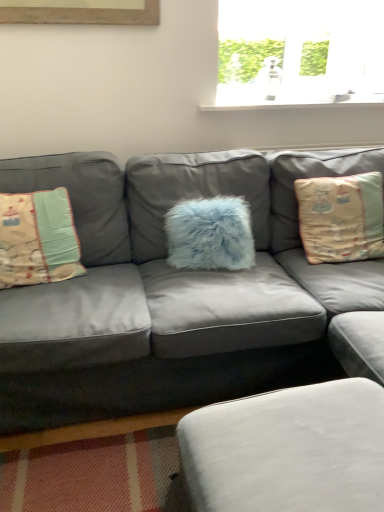
Question: Would you say beige fabric pillow at right, arranged as the 3th pillow when viewed from the left, is inside or outside beige fabric pillow at left, the 3th pillow positioned from the right?

Choices:
 (A) outside
 (B) inside

Answer: (A)

Question: Visually, is beige fabric pillow at right, arranged as the 3th pillow when viewed from the left, positioned to the left or to the right of beige fabric pillow at left, the 3th pillow positioned from the right?

Choices:
 (A) left
 (B) right

Answer: (B)

Question: Which of these objects is positioned closest to the beige fabric pillow at left, the 3th pillow positioned from the right?

Choices:
 (A) beige fabric pillow at right, arranged as the 3th pillow when viewed from the left
 (B) white fabric footrest at lower center
 (C) fluffy blue pillow at center, which is the second pillow in left-to-right order
 (D) matte gray couch at center

Answer: (D)

Question: Considering the real-world distances, which object is closest to the beige fabric pillow at right, the first pillow positioned from the right?

Choices:
 (A) fluffy blue pillow at center, the second pillow viewed from the right
 (B) matte gray couch at center
 (C) beige fabric pillow at left, the first pillow in the left-to-right sequence
 (D) white fabric footrest at lower center

Answer: (B)